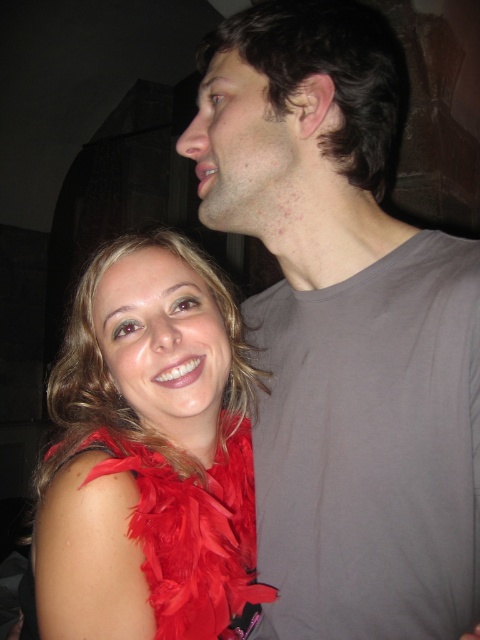
Question: Can you confirm if gray matte t-shirt at upper right is positioned above feather boa at left?

Choices:
 (A) no
 (B) yes

Answer: (B)

Question: Can you confirm if gray matte t-shirt at upper right is positioned to the right of feather boa at left?

Choices:
 (A) yes
 (B) no

Answer: (A)

Question: Which object is farther from the camera taking this photo?

Choices:
 (A) feather boa at left
 (B) gray matte t-shirt at upper right

Answer: (A)

Question: Which object is farther from the camera taking this photo?

Choices:
 (A) feather boa at left
 (B) gray matte t-shirt at upper right

Answer: (A)

Question: Which point appears farthest from the camera in this image?

Choices:
 (A) (82, 506)
 (B) (346, 493)

Answer: (A)

Question: Can you confirm if gray matte t-shirt at upper right is thinner than feather boa at left?

Choices:
 (A) no
 (B) yes

Answer: (B)